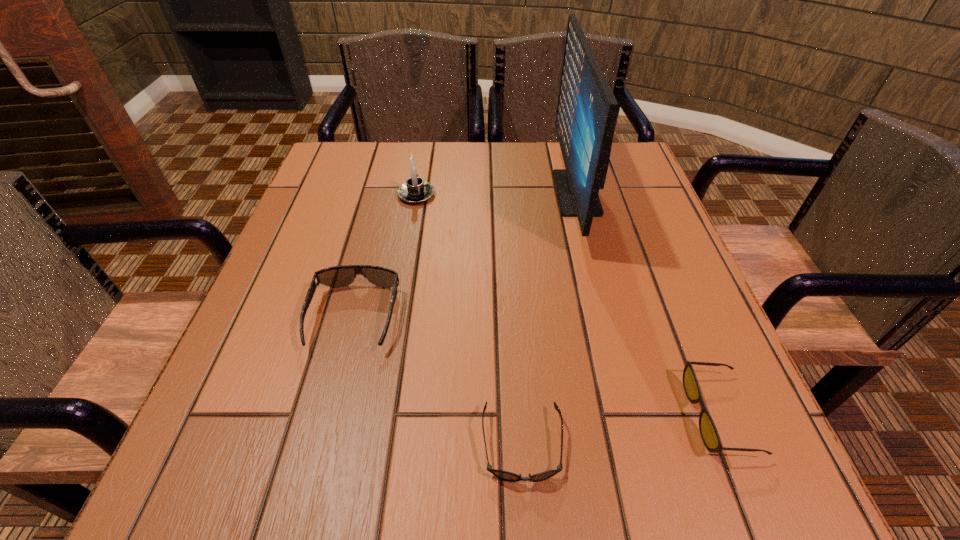
You are a GUI agent. You are given a task and a screenshot of the screen. Output one action in this format:
    pyautogui.click(x=<x>, y=<y>)
    Task: Click on the free region located 0.110m on the screen side of the tallest object
    The image size is (960, 540).
    Given the screenshot: What is the action you would take?
    pyautogui.click(x=511, y=193)

Where is `vacant space located on the screen side of the tallest object`? This screenshot has height=540, width=960. vacant space located on the screen side of the tallest object is located at coordinates (486, 193).

You are a GUI agent. You are given a task and a screenshot of the screen. Output one action in this format:
    pyautogui.click(x=<x>, y=<y>)
    Task: Click on the free space located 0.080m with a handle on the side of the candle holder
    This screenshot has height=540, width=960.
    Given the screenshot: What is the action you would take?
    pyautogui.click(x=421, y=167)

Locate an element on the screen. vacant space located with a handle on the side of the candle holder is located at coordinates pos(420,173).

I want to click on vacant space located 0.160m on the front-facing side of the third farthest object, so click(321, 450).

The image size is (960, 540). I want to click on vacant space located on the front-facing side of the fourth tallest object, so 613,415.

This screenshot has width=960, height=540. I want to click on free space located on the front-facing side of the fourth tallest object, so click(x=581, y=415).

Image resolution: width=960 pixels, height=540 pixels. I want to click on vacant position located on the front-facing side of the fourth tallest object, so click(x=442, y=415).

This screenshot has width=960, height=540. I want to click on computer monitor located at the far edge, so click(x=586, y=114).

In order to click on candle holder situated at the far edge in this screenshot , I will do `click(415, 190)`.